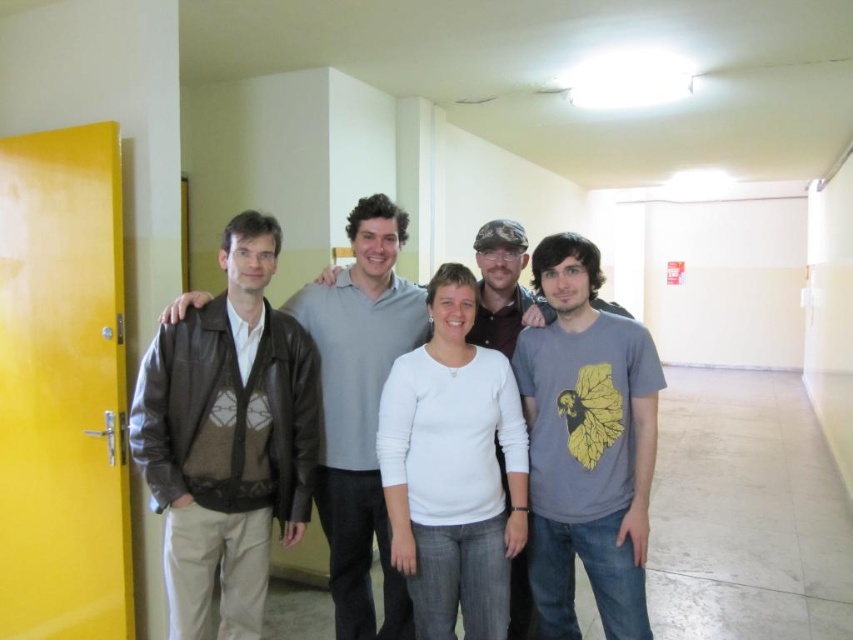
Which of these two, leather jacket at left or gray matte shirt at center, stands shorter?

Standing shorter between the two is gray matte shirt at center.

Is leather jacket at left smaller than gray matte shirt at center?

Yes, leather jacket at left is smaller than gray matte shirt at center.

Find the location of a particular element. This screenshot has width=853, height=640. leather jacket at left is located at coordinates (360, 408).

Where is `leather jacket at left`? leather jacket at left is located at coordinates (360, 408).

Can you confirm if gray matte t-shirt at center is bigger than leather jacket at left?

Actually, gray matte t-shirt at center might be smaller than leather jacket at left.

Locate an element on the screen. gray matte t-shirt at center is located at coordinates (585, 445).

Can you confirm if gray matte t-shirt at center is positioned above gray matte shirt at center?

Incorrect, gray matte t-shirt at center is not positioned above gray matte shirt at center.

Is point (601, 456) behind point (540, 317)?

No, it is in front of (540, 317).

The image size is (853, 640). I want to click on gray matte t-shirt at center, so pyautogui.click(x=585, y=445).